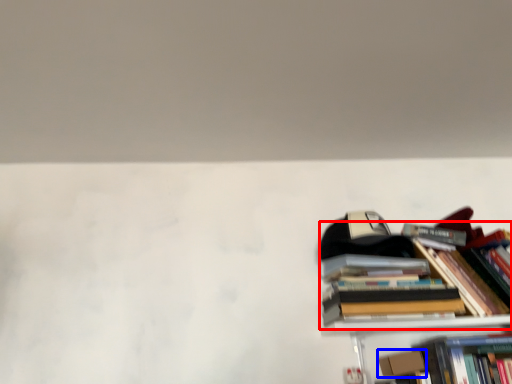
Question: Which of the following is the closest to the observer, book (highlighted by a red box) or paperback book (highlighted by a blue box)?

Choices:
 (A) book
 (B) paperback book

Answer: (A)